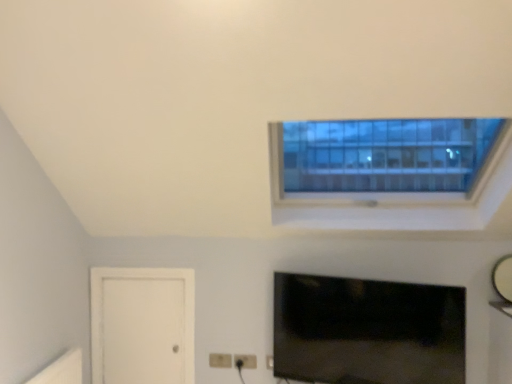
Question: Is glossy silver mirror at upper right next to matte black tv at lower center and touching it?

Choices:
 (A) yes
 (B) no

Answer: (B)

Question: Is glossy silver mirror at upper right smaller than matte black tv at lower center?

Choices:
 (A) yes
 (B) no

Answer: (A)

Question: Is glossy silver mirror at upper right positioned before matte black tv at lower center?

Choices:
 (A) no
 (B) yes

Answer: (A)

Question: Does glossy silver mirror at upper right have a lesser width compared to matte black tv at lower center?

Choices:
 (A) yes
 (B) no

Answer: (A)

Question: Is glossy silver mirror at upper right facing away from matte black tv at lower center?

Choices:
 (A) no
 (B) yes

Answer: (A)

Question: In the image, is white matte door at lower left positioned in front of or behind white plastic electric outlet at lower center?

Choices:
 (A) behind
 (B) front

Answer: (A)

Question: Looking at the image, does white matte door at lower left seem bigger or smaller compared to white plastic electric outlet at lower center?

Choices:
 (A) small
 (B) big

Answer: (B)

Question: Looking at their shapes, would you say white matte door at lower left is wider or thinner than white plastic electric outlet at lower center?

Choices:
 (A) thin
 (B) wide

Answer: (B)

Question: From the image's perspective, is white matte door at lower left located above or below white plastic electric outlet at lower center?

Choices:
 (A) below
 (B) above

Answer: (B)

Question: Is point (245, 355) positioned closer to the camera than point (501, 276)?

Choices:
 (A) closer
 (B) farther

Answer: (B)

Question: From a real-world perspective, is white plastic electric outlet at lower center above or below glossy silver mirror at upper right?

Choices:
 (A) above
 (B) below

Answer: (B)

Question: Would you say white plastic electric outlet at lower center is to the left or to the right of glossy silver mirror at upper right in the picture?

Choices:
 (A) left
 (B) right

Answer: (A)

Question: From the image's perspective, is white plastic electric outlet at lower center located above or below glossy silver mirror at upper right?

Choices:
 (A) above
 (B) below

Answer: (B)

Question: Considering the positions of white matte door at lower left and matte black tv at lower center in the image, is white matte door at lower left wider or thinner than matte black tv at lower center?

Choices:
 (A) thin
 (B) wide

Answer: (A)

Question: From the image's perspective, is white matte door at lower left above or below matte black tv at lower center?

Choices:
 (A) above
 (B) below

Answer: (B)